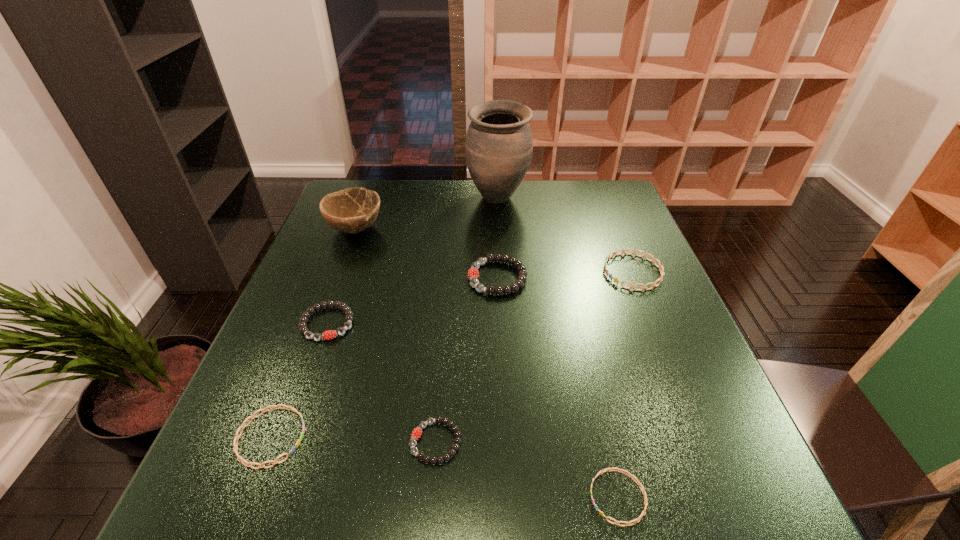
The width and height of the screenshot is (960, 540). I want to click on the tallest object, so click(498, 149).

Locate an element on the screen. This screenshot has width=960, height=540. bowl is located at coordinates (352, 210).

Identify the location of the tallest bracelet. This screenshot has height=540, width=960. (473, 273).

Find the location of a particular element. The width and height of the screenshot is (960, 540). the third bracelet from right to left is located at coordinates (473, 273).

The height and width of the screenshot is (540, 960). I want to click on the rightmost object, so click(x=659, y=266).

What are the coordinates of `the biggest blue bracelet` in the screenshot? It's located at pyautogui.click(x=659, y=266).

Find the location of `the third farthest bracelet`. the third farthest bracelet is located at coordinates (303, 329).

This screenshot has width=960, height=540. In order to click on the second nearest black bracelet in this screenshot , I will do `click(303, 329)`.

Where is `the second smallest blue bracelet`? Image resolution: width=960 pixels, height=540 pixels. the second smallest blue bracelet is located at coordinates (248, 464).

At what (x,y) coordinates should I click in order to perform the action: click on the third bracelet from left to right. Please return your answer as a coordinate pair (x, y). The width and height of the screenshot is (960, 540). Looking at the image, I should click on (417, 432).